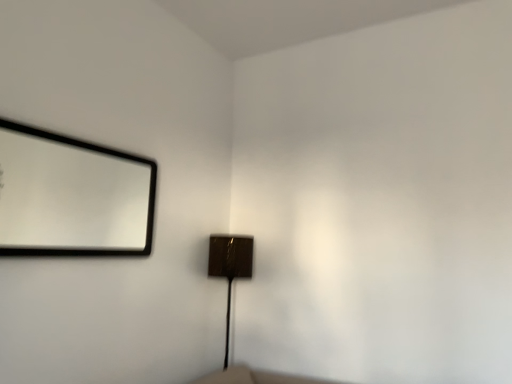
Question: Which is correct: shiny brown lamp at center is inside matte black mirror at upper left, or outside of it?

Choices:
 (A) outside
 (B) inside

Answer: (A)

Question: Considering their positions, is shiny brown lamp at center located in front of or behind matte black mirror at upper left?

Choices:
 (A) front
 (B) behind

Answer: (B)

Question: Considering the positions of shiny brown lamp at center and matte black mirror at upper left in the image, is shiny brown lamp at center bigger or smaller than matte black mirror at upper left?

Choices:
 (A) big
 (B) small

Answer: (A)

Question: Is matte black mirror at upper left inside or outside of shiny brown lamp at center?

Choices:
 (A) inside
 (B) outside

Answer: (B)

Question: Is point (89, 235) positioned closer to the camera than point (234, 251)?

Choices:
 (A) farther
 (B) closer

Answer: (A)

Question: Considering the positions of matte black mirror at upper left and shiny brown lamp at center in the image, is matte black mirror at upper left taller or shorter than shiny brown lamp at center?

Choices:
 (A) tall
 (B) short

Answer: (B)

Question: In the image, is matte black mirror at upper left on the left side or the right side of shiny brown lamp at center?

Choices:
 (A) right
 (B) left

Answer: (B)